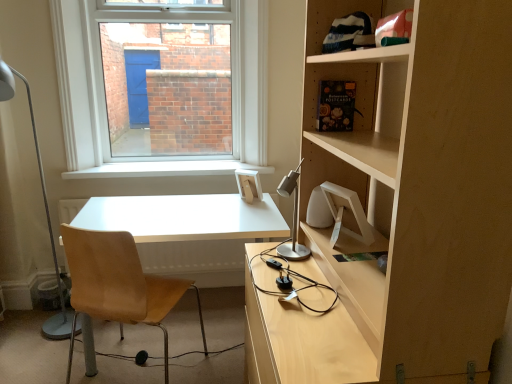
At what (x,y) coordinates should I click in order to perform the action: click on vacant area on top of white matte desk at center (from a real-world perspective). Please return your answer as a coordinate pair (x, y). The height and width of the screenshot is (384, 512). Looking at the image, I should click on (162, 217).